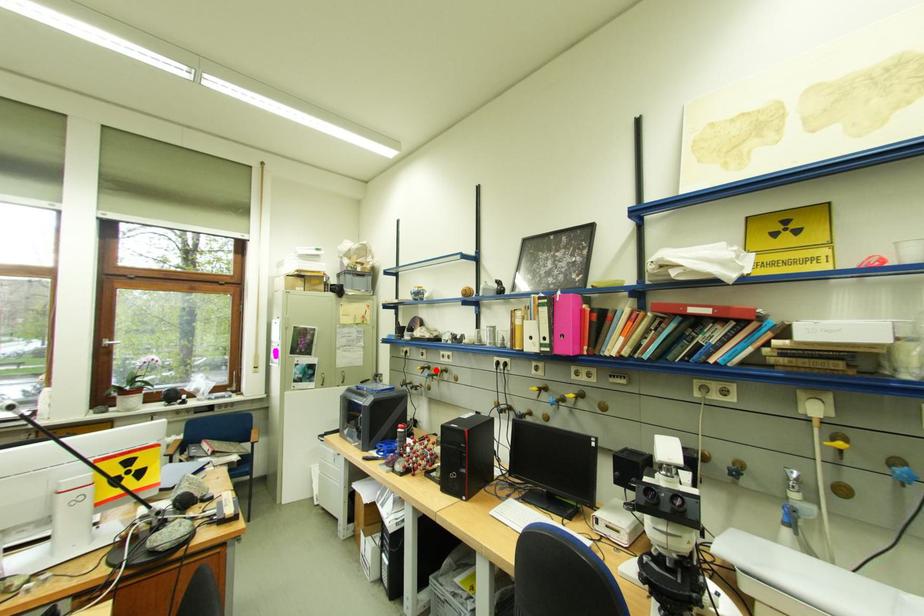
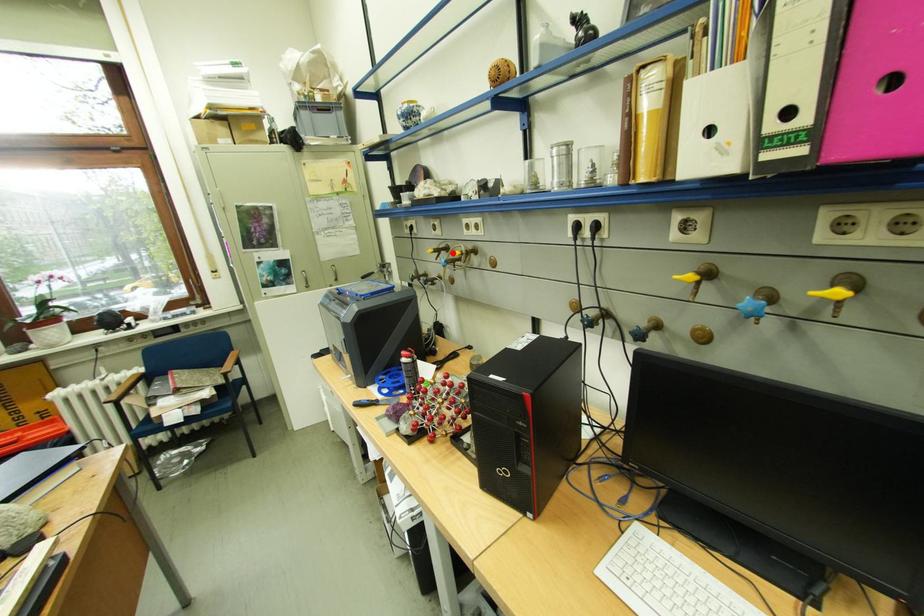
I am providing you with two images of the same scene from different viewpoints. A red point is marked on the first image and another point is marked on the second image. Is the marked point in image1 the same physical position as the marked point in image2?

Yes